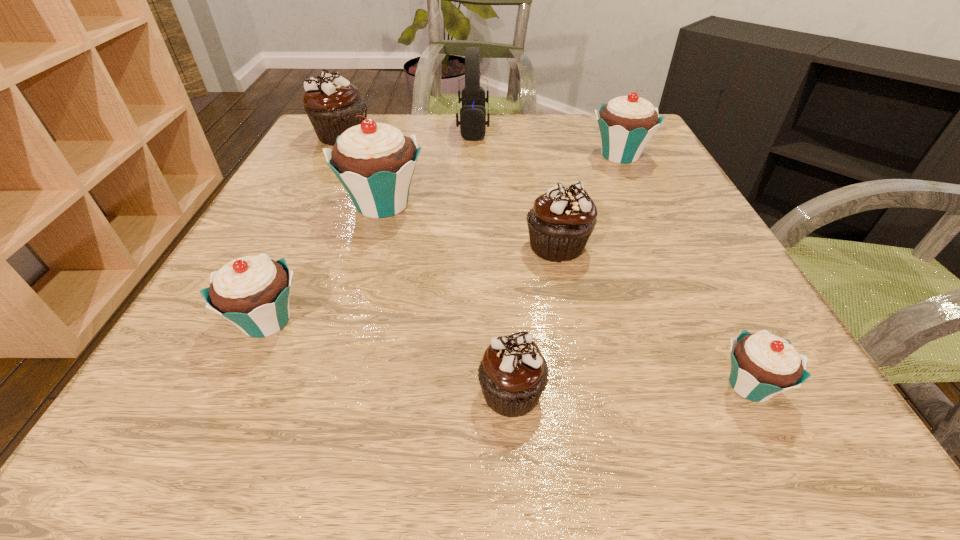
Find the location of `the nearest teal cupcake`. the nearest teal cupcake is located at coordinates (763, 365).

Image resolution: width=960 pixels, height=540 pixels. Find the location of `free space located 0.050m on the headband of the headset`. free space located 0.050m on the headband of the headset is located at coordinates (508, 127).

You are a GUI agent. You are given a task and a screenshot of the screen. Output one action in this format:
    pyautogui.click(x=<x>, y=<y>)
    Task: Click on the free spot located 0.260m on the right of the tallest cupcake
    The height and width of the screenshot is (540, 960).
    Given the screenshot: What is the action you would take?
    pyautogui.click(x=558, y=204)

Where is `vacant space situated on the right of the leftmost brown cupcake`? vacant space situated on the right of the leftmost brown cupcake is located at coordinates (464, 135).

Identify the location of free space located on the left of the third smallest teal cupcake. (567, 156).

At what (x,y) coordinates should I click in order to perform the action: click on free region located 0.120m on the left of the second smallest brown cupcake. Please return your answer as a coordinate pair (x, y). Looking at the image, I should click on (457, 246).

You are a GUI agent. You are given a task and a screenshot of the screen. Output one action in this format:
    pyautogui.click(x=<x>, y=<y>)
    Task: Click on the free space located 0.110m on the back of the fifth farthest cupcake
    
    Given the screenshot: What is the action you would take?
    pyautogui.click(x=300, y=248)

Find the location of a particular element. The width and height of the screenshot is (960, 540). free spot located 0.290m on the back of the smallest brown cupcake is located at coordinates (502, 233).

Locate an element on the screen. vacant space located 0.360m on the back of the nearest teal cupcake is located at coordinates (659, 208).

Locate an element on the screen. The width and height of the screenshot is (960, 540). headset that is at the far edge is located at coordinates (472, 122).